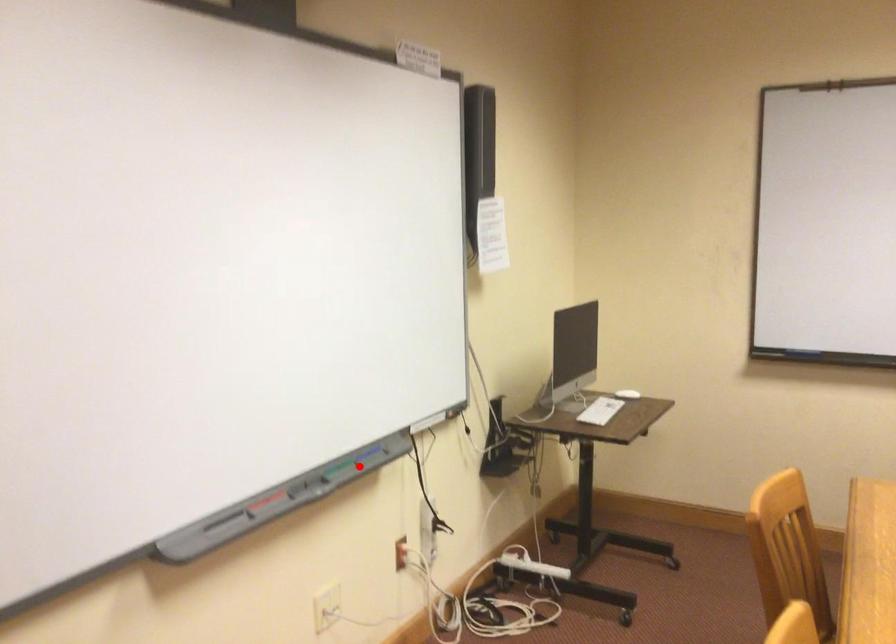
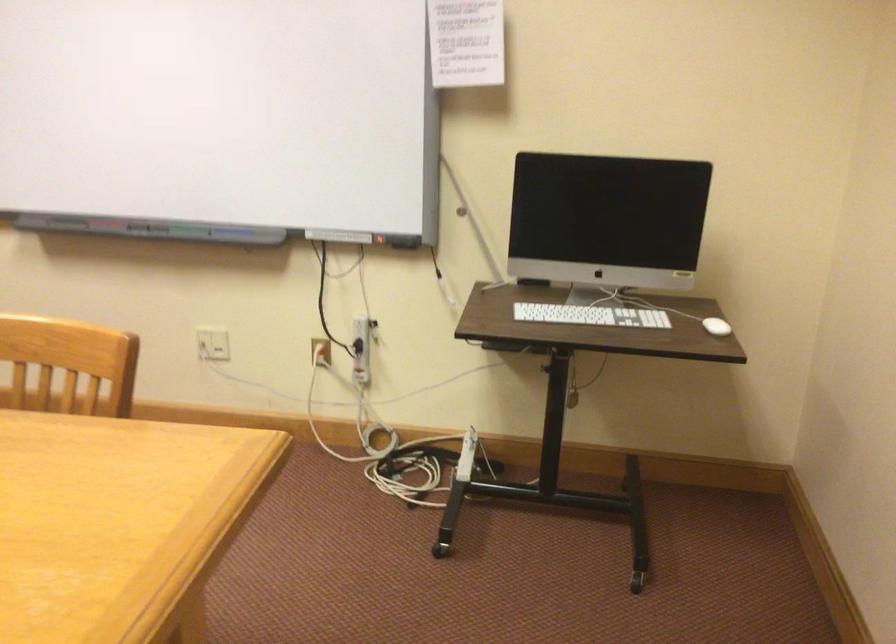
Find the pixel in the second image that matches the highlighted location in the first image.

(187, 230)